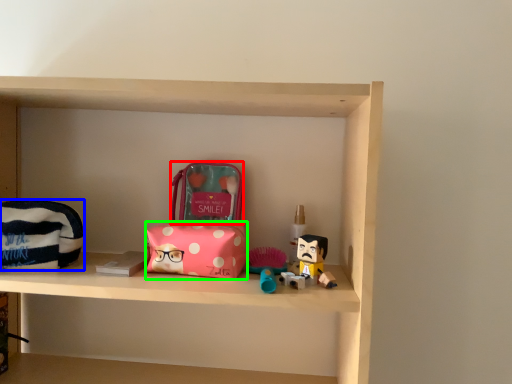
Question: Based on their relative distances, which object is farther from pouch (highlighted by a red box)? Choose from pouch (highlighted by a blue box) and package (highlighted by a green box).

Choices:
 (A) pouch
 (B) package

Answer: (A)